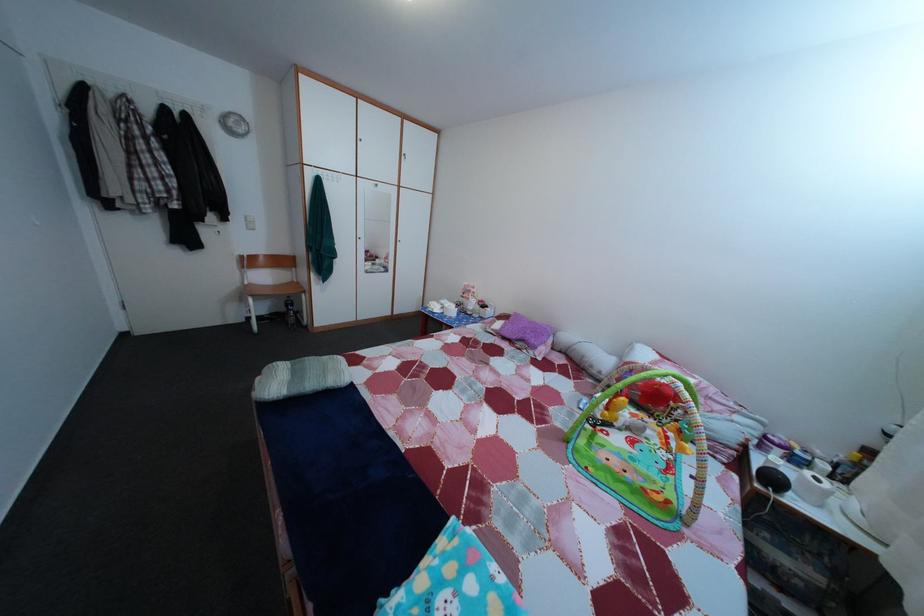
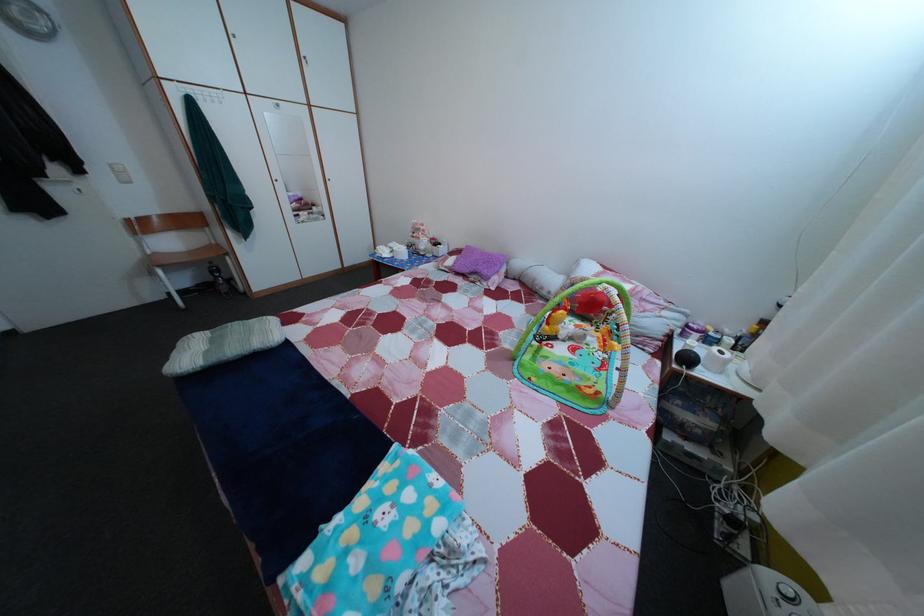
Where in the second image is the point corresponding to the point at 541,330 from the first image?

(492, 261)